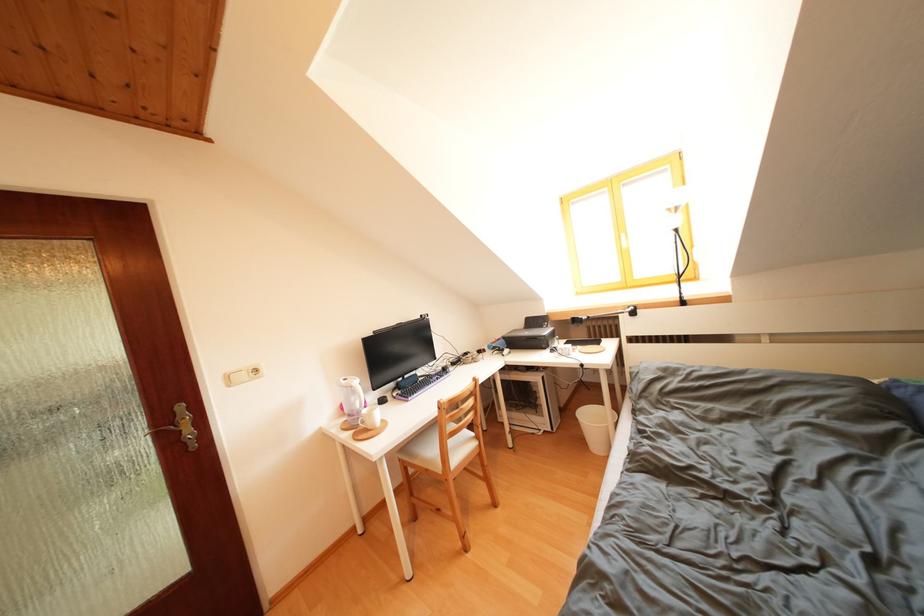
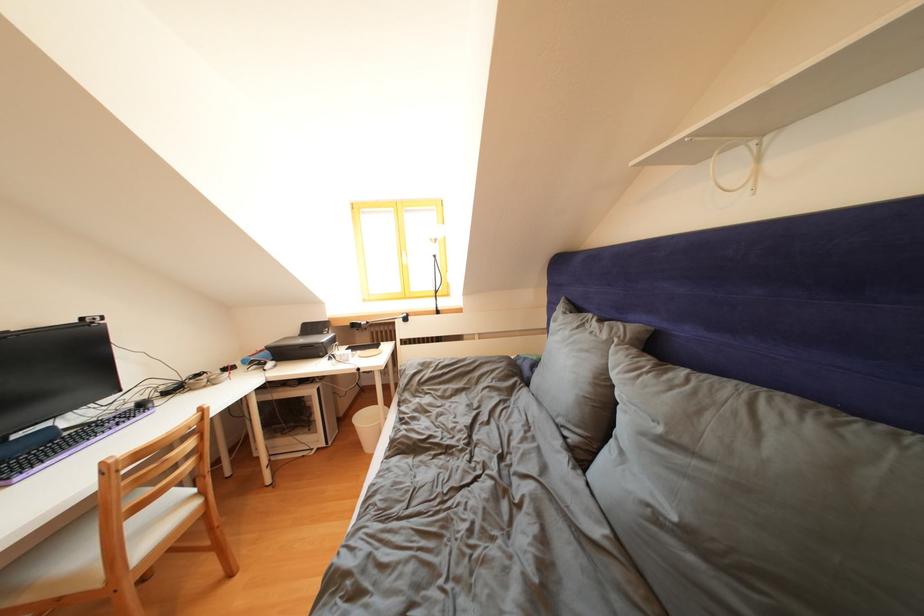
In the second image, find the point that corresponds to pixel 541 328 in the first image.

(319, 333)